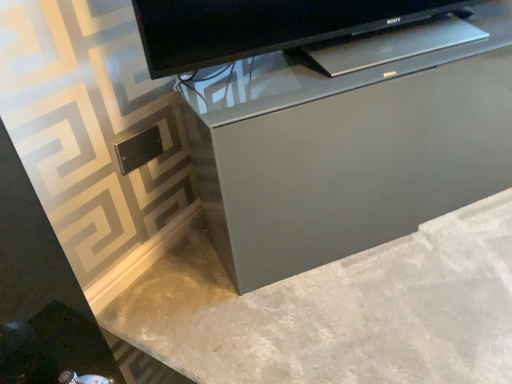
Identify the location of vacant space in front of satin gray cabinet at center. This screenshot has width=512, height=384. (401, 291).